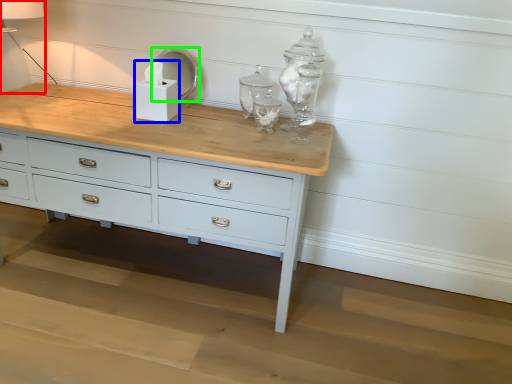
Question: Estimate the real-world distances between objects in this image. Which object is farther from table lamp (highlighted by a red box), candle holder (highlighted by a blue box) or mirror (highlighted by a green box)?

Choices:
 (A) candle holder
 (B) mirror

Answer: (A)